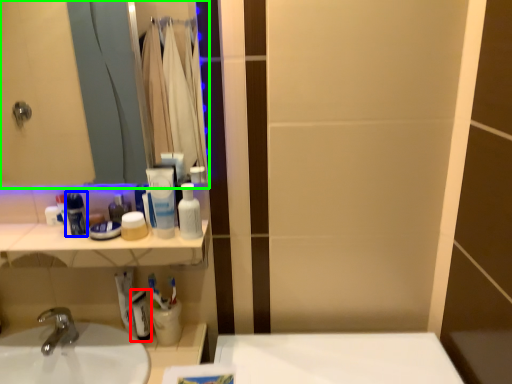
Question: Which is farther away from mouthwash (highlighted by a red box)? mouthwash (highlighted by a blue box) or mirror (highlighted by a green box)?

Choices:
 (A) mouthwash
 (B) mirror

Answer: (B)